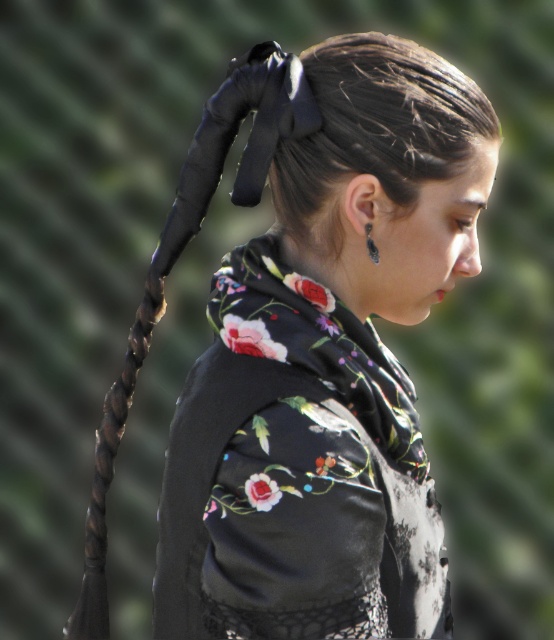
Does floral satin dress at center have a greater width compared to silver metallic earring at ear?

Yes, floral satin dress at center is wider than silver metallic earring at ear.

Which of these two, floral satin dress at center or silver metallic earring at ear, stands shorter?

Standing shorter between the two is silver metallic earring at ear.

Is point (269, 451) positioned before point (366, 227)?

Yes, point (269, 451) is in front of point (366, 227).

At what (x,y) coordinates should I click in order to perform the action: click on floral satin dress at center. Please return your answer as a coordinate pair (x, y). This screenshot has width=554, height=640. Looking at the image, I should click on (295, 474).

Which is more to the left, black satin bow at center or silver metallic earring at ear?

From the viewer's perspective, silver metallic earring at ear appears more on the left side.

The height and width of the screenshot is (640, 554). Identify the location of black satin bow at center. (375, 131).

Between floral satin dress at center and black satin bow at center, which one appears on the left side from the viewer's perspective?

Positioned to the left is floral satin dress at center.

Who is shorter, floral satin dress at center or black satin bow at center?

black satin bow at center is shorter.

Is point (157, 595) closer to viewer compared to point (365, 61)?

No.

This screenshot has width=554, height=640. Find the location of `floral satin dress at center`. floral satin dress at center is located at coordinates (295, 474).